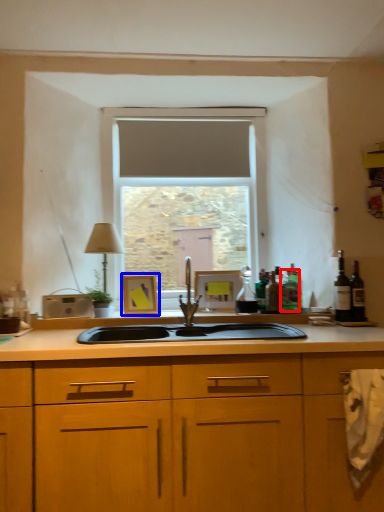
Question: Which object appears farthest to the camera in this image, bottle (highlighted by a red box) or picture frame (highlighted by a blue box)?

Choices:
 (A) bottle
 (B) picture frame

Answer: (B)